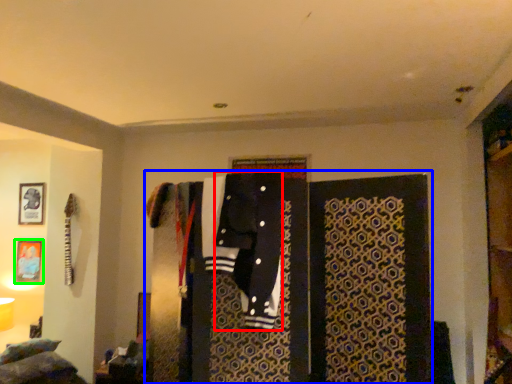
Question: Based on their relative distances, which object is farther from clothing (highlighted by a red box)? Choose from closet (highlighted by a blue box) and picture frame (highlighted by a green box).

Choices:
 (A) closet
 (B) picture frame

Answer: (B)